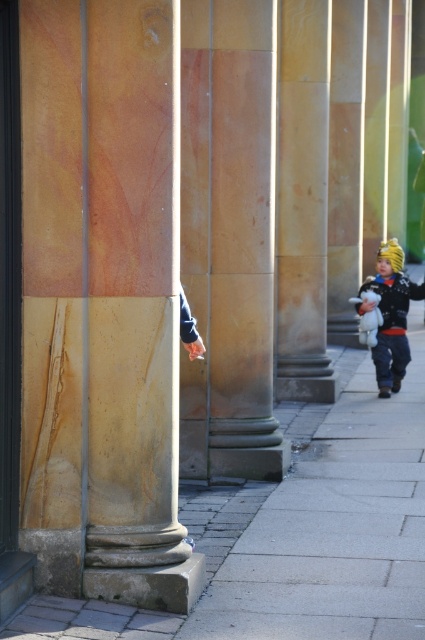
Question: Does marble column at center have a greater width compared to matte black jacket at lower right?

Choices:
 (A) no
 (B) yes

Answer: (B)

Question: Which point is closer to the camera?

Choices:
 (A) (87, 305)
 (B) (354, 452)

Answer: (A)

Question: Which of the following is the farthest from the observer?

Choices:
 (A) (346, 449)
 (B) (57, 253)

Answer: (A)

Question: Is marble column at center positioned behind matte black jacket at lower right?

Choices:
 (A) yes
 (B) no

Answer: (B)

Question: Does gray concrete pavement at center lie in front of matte black jacket at lower right?

Choices:
 (A) yes
 (B) no

Answer: (A)

Question: Which point is farther from the camera taking this photo?

Choices:
 (A) (399, 396)
 (B) (99, 417)

Answer: (A)